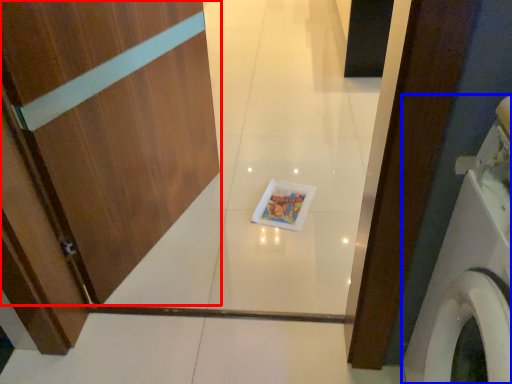
Question: Which point is closer to the camera, door (highlighted by a red box) or washing machine (highlighted by a blue box)?

Choices:
 (A) door
 (B) washing machine

Answer: (B)